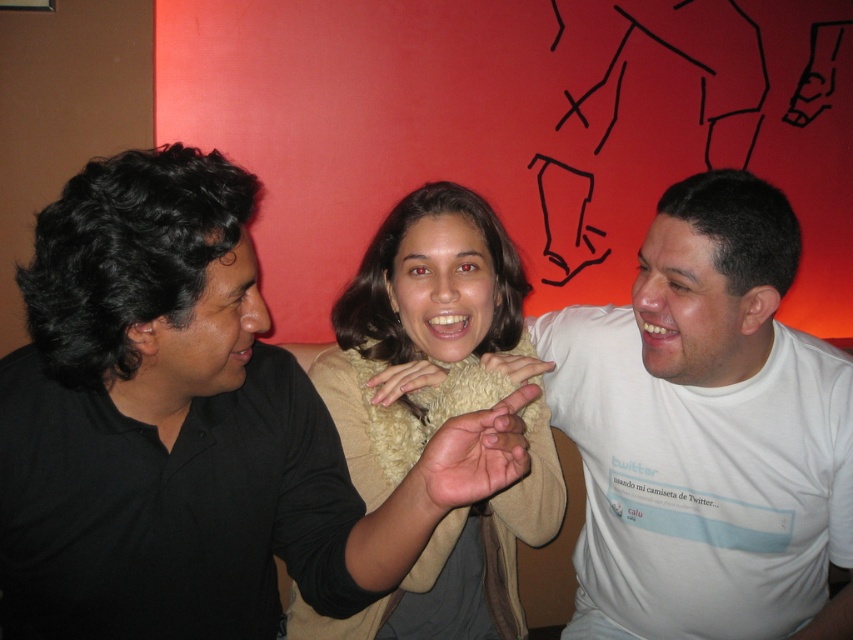
Based on the photo, which of these two, black matte shirt at left or white cotton shirt at center, stands taller?

With more height is white cotton shirt at center.

Is black matte shirt at left in front of white cotton shirt at center?

Yes, black matte shirt at left is closer to the viewer.

Is point (308, 452) positioned before point (712, 472)?

Yes, point (308, 452) is closer to viewer.

Identify the location of black matte shirt at left. (189, 428).

What do you see at coordinates (706, 432) in the screenshot?
I see `white cotton shirt at center` at bounding box center [706, 432].

Where is `white cotton shirt at center`? The image size is (853, 640). white cotton shirt at center is located at coordinates (706, 432).

Can you confirm if black matte shirt at left is taller than beige fuzzy scarf at center?

In fact, black matte shirt at left may be shorter than beige fuzzy scarf at center.

Is black matte shirt at left shorter than beige fuzzy scarf at center?

Correct, black matte shirt at left is not as tall as beige fuzzy scarf at center.

Which is in front, point (321, 497) or point (473, 195)?

Point (321, 497)

Image resolution: width=853 pixels, height=640 pixels. Identify the location of black matte shirt at left. (189, 428).